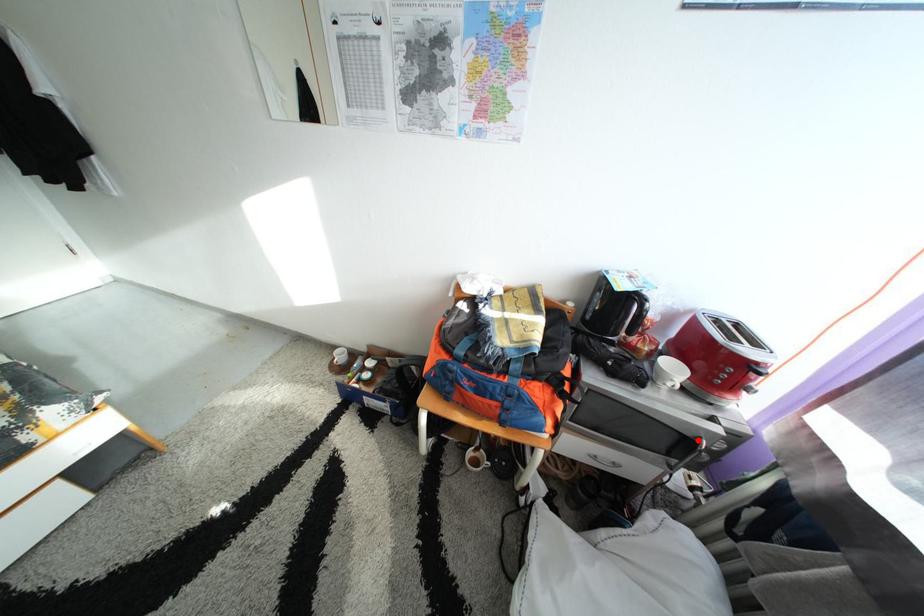
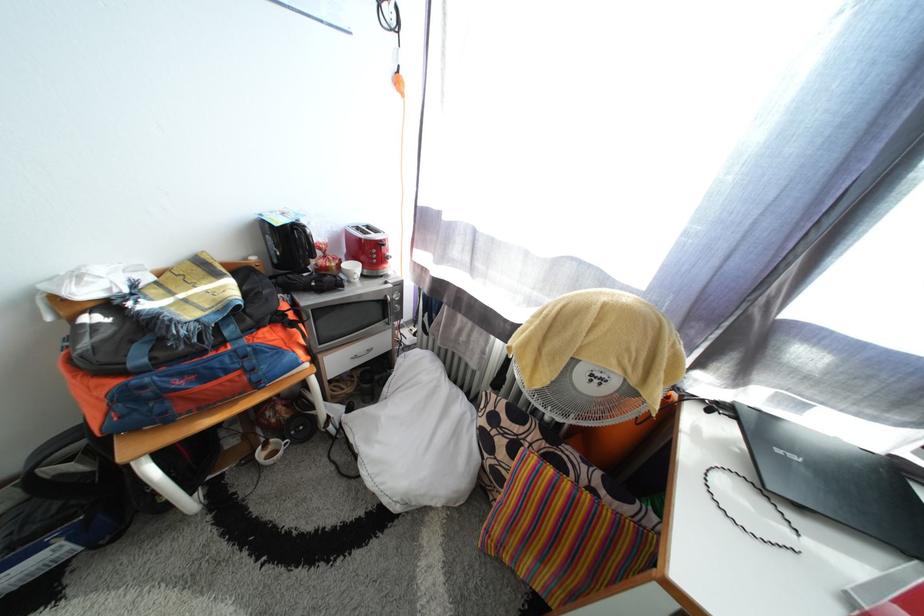
Question: I am providing you with two images of the same scene from different viewpoints. A red point is marked on the first image. Is the red point's position out of view in image 2?

Choices:
 (A) Yes
 (B) No

Answer: (B)